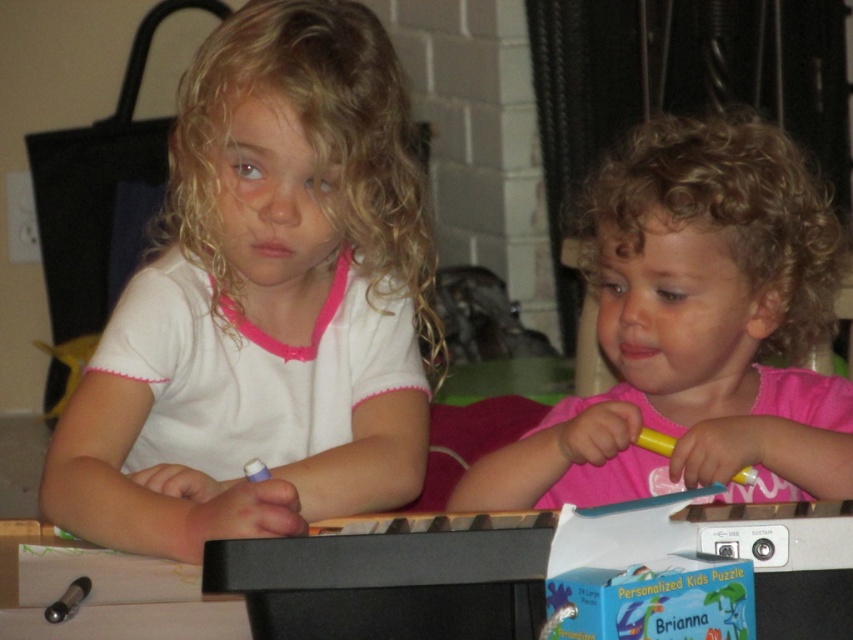
You are a photographer trying to capture a closeup of the white matte shirt at center. Based on the coordinates provided in the Objects Description, where should you position your camera relative to the children?

The white matte shirt at center is located at point (x=264, y=304), so you should position your camera directly in front of the shirt at those coordinates to capture the closeup.

From the picture: You are a photographer taking a picture of the two children. The pink matte shirt at center and the yellow matte crayon at lower center are in the frame. Which object is positioned higher in the image?

The pink matte shirt at center is located above the yellow matte crayon at lower center, so it is positioned higher in the image.